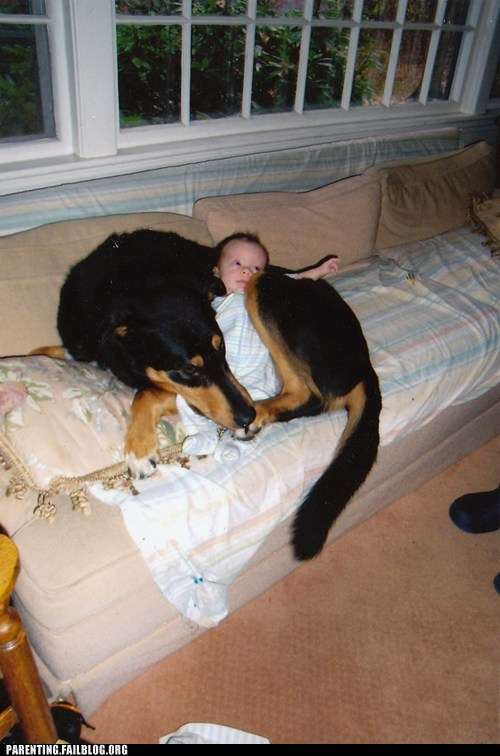
Locate an element on the screen. Image resolution: width=500 pixels, height=756 pixels. carpet is located at coordinates (372, 643).